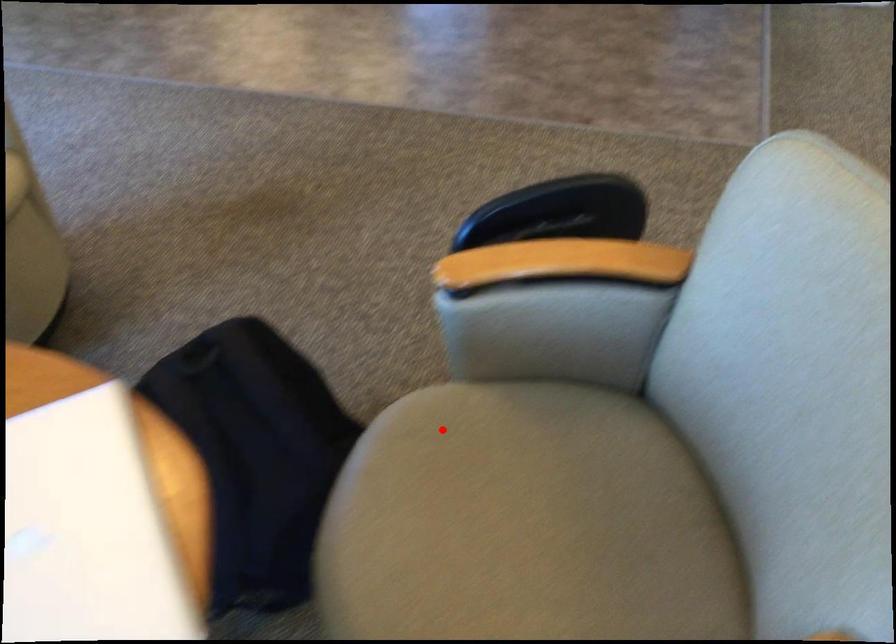
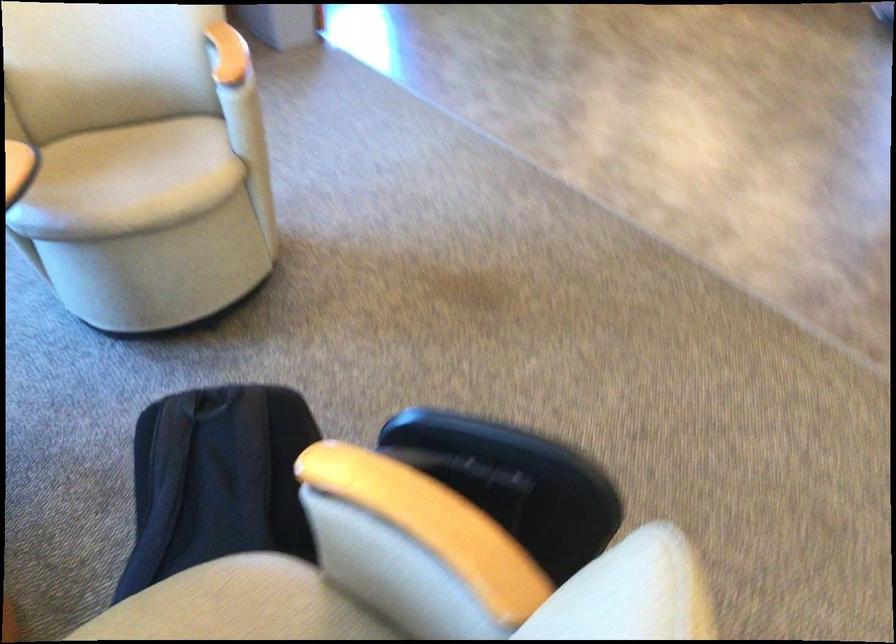
Question: A red point is marked in image1. In image2, is the corresponding 3D point closer to the camera or farther? Reply with the corresponding letter.

Choices:
 (A) The corresponding 3D point is closer.
 (B) The corresponding 3D point is farther.

Answer: (A)